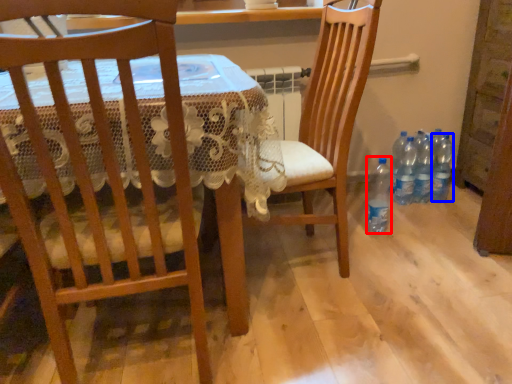
Question: Among these objects, which one is farthest to the camera, bottle (highlighted by a red box) or bottle (highlighted by a blue box)?

Choices:
 (A) bottle
 (B) bottle

Answer: (B)